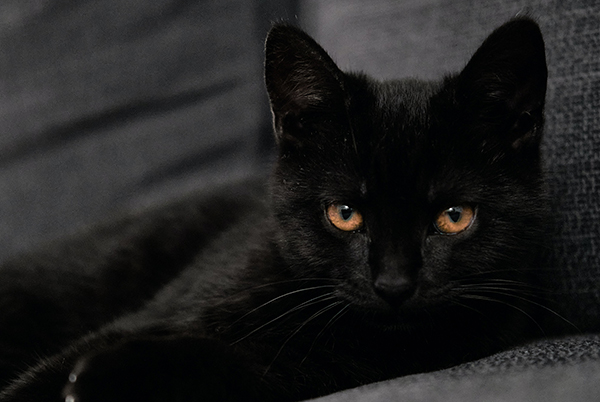
At what (x,y) coordinates should I click in order to perform the action: click on cushion. Please return your answer as a coordinate pair (x, y). This screenshot has width=600, height=402. Looking at the image, I should click on pos(574,365).